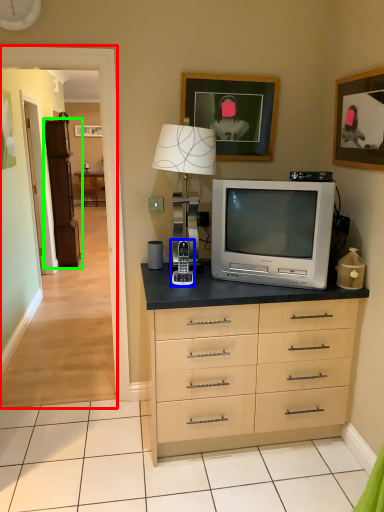
Question: Based on their relative distances, which object is nearer to corridor (highlighted by a red box)? Choose from appliance (highlighted by a blue box) and armoire (highlighted by a green box).

Choices:
 (A) appliance
 (B) armoire

Answer: (A)